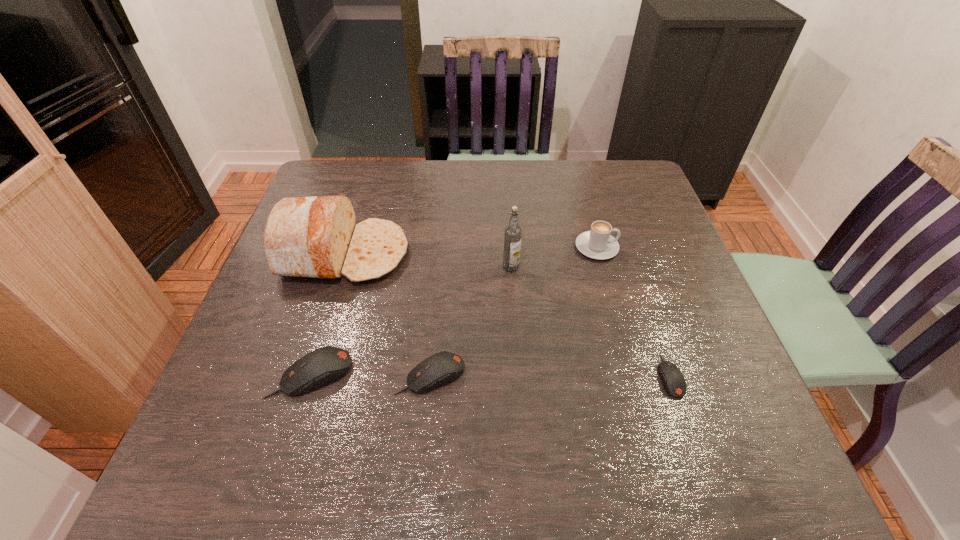
Please determine a free point for an extra mouse_(computer_equipment) to ensure balance. Please provide its 2D coordinates. Your answer should be formatted as a tuple, i.e. [(x, y)], where the tuple contains the x and y coordinates of a point satisfying the conditions above.

[(550, 375)]